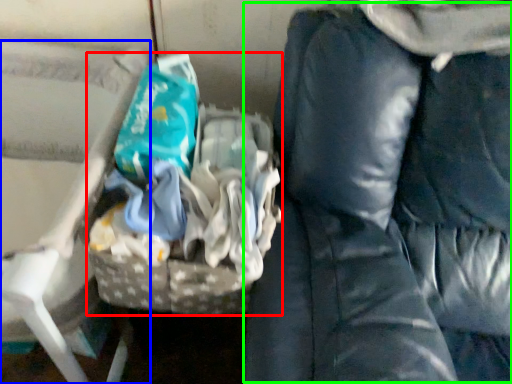
Question: Which object is positioned closest to waste (highlighted by a red box)? Select from furniture (highlighted by a blue box) and bean bag chair (highlighted by a green box).

Choices:
 (A) furniture
 (B) bean bag chair

Answer: (B)